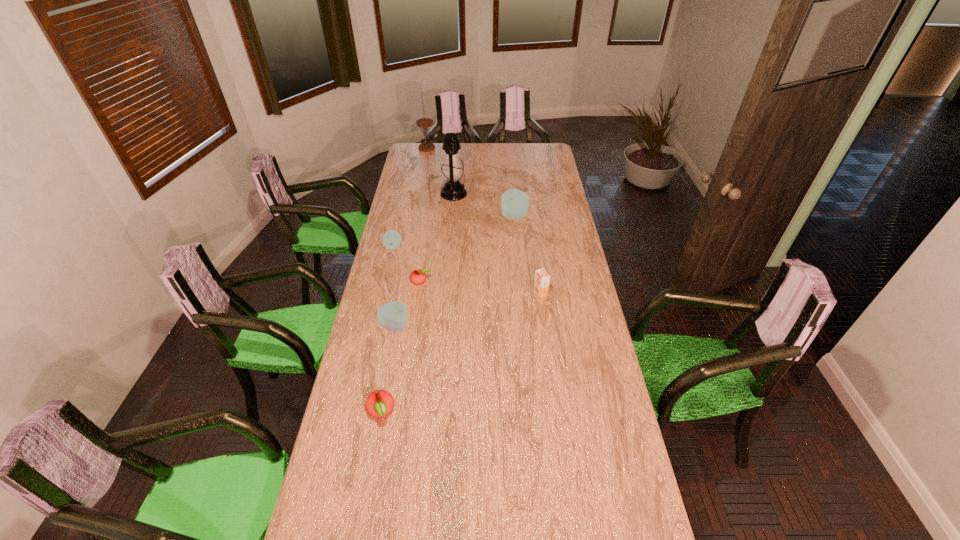
Where is `the second nearest white apple`? The height and width of the screenshot is (540, 960). the second nearest white apple is located at coordinates point(391,239).

The height and width of the screenshot is (540, 960). I want to click on the nearest object, so click(x=379, y=403).

Locate an element on the screen. The height and width of the screenshot is (540, 960). the bigger red apple is located at coordinates (379, 403).

Where is `the smaller red apple`? the smaller red apple is located at coordinates (417, 277).

Where is `the farther red apple`? the farther red apple is located at coordinates (417, 277).

In order to click on vacant space located on the back of the black oil lamp in this screenshot , I will do `click(457, 152)`.

Find the location of a particular element. The width and height of the screenshot is (960, 540). vacant area situated on the right of the farthest object is located at coordinates pos(482,148).

Find the location of a particular element. vacant space located on the back of the farthest white apple is located at coordinates (511, 183).

You are a GUI agent. You are given a task and a screenshot of the screen. Output one action in this format:
    pyautogui.click(x=<x>, y=<y>)
    Task: Click on the blank space located on the right of the seventh farthest object
    Image resolution: width=960 pixels, height=540 pixels.
    Given the screenshot: What is the action you would take?
    pyautogui.click(x=427, y=326)

Find the location of `free spot located 0.140m on the back of the orange orange juice`. free spot located 0.140m on the back of the orange orange juice is located at coordinates (537, 266).